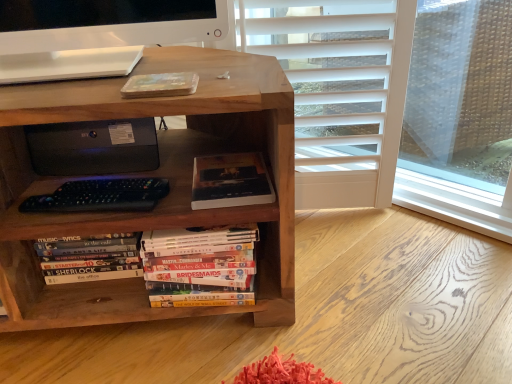
Question: Considering the relative sizes of black matte printer at center and wooden bookcase at center in the image provided, is black matte printer at center thinner than wooden bookcase at center?

Choices:
 (A) no
 (B) yes

Answer: (B)

Question: Considering the relative positions of black matte printer at center and wooden bookcase at center in the image provided, is black matte printer at center behind wooden bookcase at center?

Choices:
 (A) no
 (B) yes

Answer: (B)

Question: Is black matte printer at center in contact with wooden bookcase at center?

Choices:
 (A) yes
 (B) no

Answer: (B)

Question: From the image's perspective, is black matte printer at center below wooden bookcase at center?

Choices:
 (A) yes
 (B) no

Answer: (B)

Question: From the image's perspective, is black matte printer at center over wooden bookcase at center?

Choices:
 (A) no
 (B) yes

Answer: (B)

Question: Is black matte printer at center wider than wooden bookcase at center?

Choices:
 (A) no
 (B) yes

Answer: (A)

Question: Is dark matte book at center, positioned as the first book in right-to-left order, taller than wooden bookcase at center?

Choices:
 (A) no
 (B) yes

Answer: (A)

Question: Is dark matte book at center, positioned as the first book in right-to-left order, behind wooden bookcase at center?

Choices:
 (A) no
 (B) yes

Answer: (B)

Question: Is dark matte book at center, the second book ordered from the bottom, far away from wooden bookcase at center?

Choices:
 (A) yes
 (B) no

Answer: (B)

Question: Is dark matte book at center, positioned as the first book in right-to-left order, positioned with its back to wooden bookcase at center?

Choices:
 (A) no
 (B) yes

Answer: (B)

Question: Does dark matte book at center, placed as the second book when sorted from left to right, appear on the right side of wooden bookcase at center?

Choices:
 (A) no
 (B) yes

Answer: (B)

Question: Can you confirm if dark matte book at center, positioned as the first book in right-to-left order, is thinner than wooden bookcase at center?

Choices:
 (A) no
 (B) yes

Answer: (B)

Question: From the image's perspective, is wooden bookcase at center under hardcover books at lower left, arranged as the first book when viewed from the left?

Choices:
 (A) no
 (B) yes

Answer: (A)